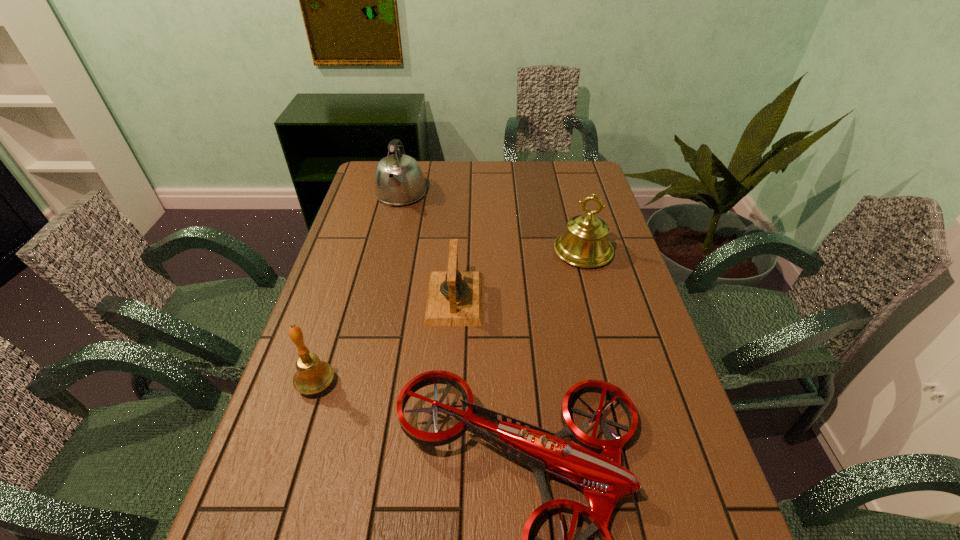
The image size is (960, 540). I want to click on kettle, so click(x=398, y=180).

Where is `the farthest bell`? This screenshot has height=540, width=960. the farthest bell is located at coordinates (584, 244).

Where is `the second farthest object`? Image resolution: width=960 pixels, height=540 pixels. the second farthest object is located at coordinates (584, 244).

This screenshot has height=540, width=960. In order to click on the nearest bell in this screenshot , I will do `click(312, 376)`.

Image resolution: width=960 pixels, height=540 pixels. What are the coordinates of `the second bell from right to left` in the screenshot? It's located at (454, 298).

Locate an element on the screen. the shortest bell is located at coordinates (454, 298).

The image size is (960, 540). Find the location of `vacant region located on the spout of the kettle`. vacant region located on the spout of the kettle is located at coordinates (379, 284).

Locate an element on the screen. vacant space located on the back of the fourth nearest object is located at coordinates (564, 181).

Find the location of a particular element. Image resolution: width=960 pixels, height=540 pixels. vacant region located 0.370m on the back of the nearest bell is located at coordinates (353, 267).

Where is `vacant space positioned 0.170m on the right of the second bell from left to right`? vacant space positioned 0.170m on the right of the second bell from left to right is located at coordinates (541, 298).